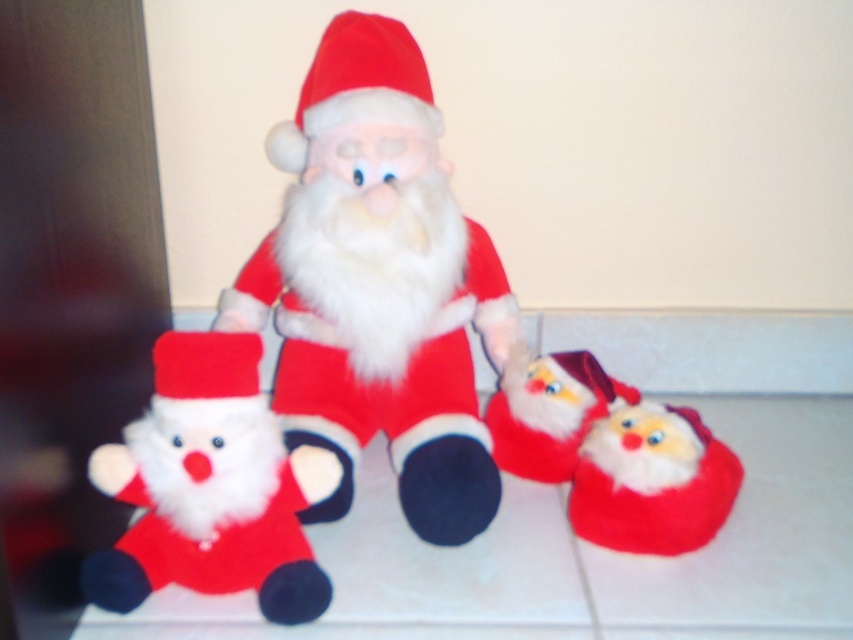
Question: Which object is positioned farthest from the fuzzy fabric santa at center?

Choices:
 (A) velvety red santa at center
 (B) velvety red santa at left
 (C) fuzzy red santa hat at lower right
 (D) matte fabric santa hat at center

Answer: (D)

Question: Does fuzzy red santa hat at lower right appear over matte fabric santa hat at center?

Choices:
 (A) no
 (B) yes

Answer: (A)

Question: Which point is farther to the camera?

Choices:
 (A) velvety red santa at center
 (B) fuzzy fabric santa at center
 (C) matte fabric santa hat at center

Answer: (B)

Question: In this image, where is velvety red santa at center located relative to matte fabric santa hat at center?

Choices:
 (A) left
 (B) right

Answer: (B)

Question: Is fuzzy fabric santa at center further to the viewer compared to matte fabric santa hat at center?

Choices:
 (A) yes
 (B) no

Answer: (A)

Question: Which object is farther from the camera taking this photo?

Choices:
 (A) velvety red santa at left
 (B) matte fabric santa hat at center
 (C) velvety red santa at center
 (D) fuzzy fabric santa at center

Answer: (D)